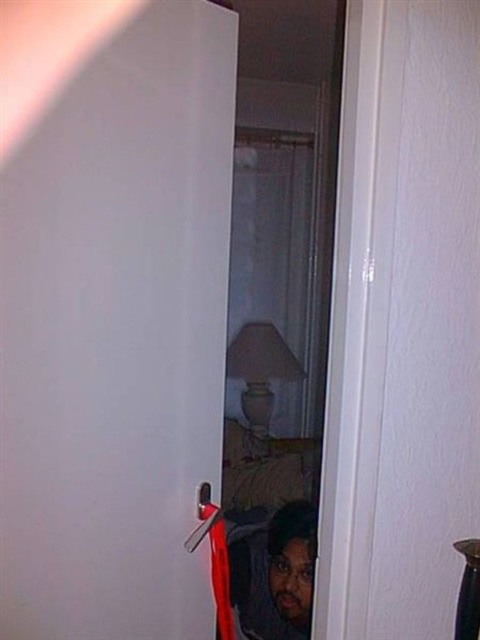
Can you confirm if white glossy door at center is wider than dark brown hair at lower center?

Yes.

Between point (169, 465) and point (266, 625), which one is positioned in front?

Point (169, 465) is more forward.

Find the location of a particular element. white glossy door at center is located at coordinates (117, 336).